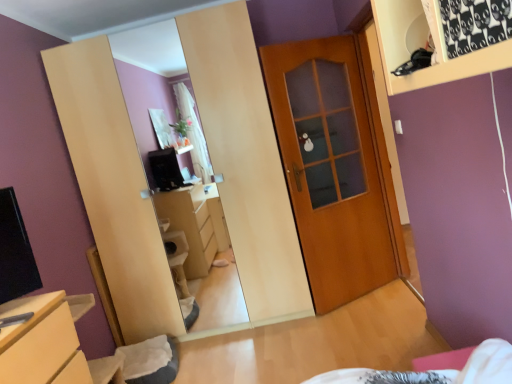
What do you see at coordinates (421, 44) in the screenshot? Image resolution: width=512 pixels, height=384 pixels. I see `black fabric at upper right` at bounding box center [421, 44].

The image size is (512, 384). What are the coordinates of `matte wood chest of drawers at lower left` in the screenshot? It's located at (40, 342).

This screenshot has width=512, height=384. In order to click on black fabric at upper right in this screenshot , I will do `click(421, 44)`.

Considering the sizes of matte wood chest of drawers at lower left and wooden door at center in the image, is matte wood chest of drawers at lower left bigger or smaller than wooden door at center?

Clearly, matte wood chest of drawers at lower left is larger in size than wooden door at center.

Is matte wood chest of drawers at lower left taller than wooden door at center?

No.

Is matte wood chest of drawers at lower left closer to the viewer compared to wooden door at center?

Yes, it is.

Which is correct: black fabric at upper right is inside matte wood chest of drawers at lower left, or outside of it?

The correct answer is: outside.

In terms of width, does black fabric at upper right look wider or thinner when compared to matte wood chest of drawers at lower left?

Clearly, black fabric at upper right has less width compared to matte wood chest of drawers at lower left.

What's the angular difference between black fabric at upper right and matte wood chest of drawers at lower left's facing directions?

The angular difference between black fabric at upper right and matte wood chest of drawers at lower left is 178 degrees.

Is black fabric at upper right turned away from matte wood chest of drawers at lower left?

No, black fabric at upper right is not facing the opposite direction of matte wood chest of drawers at lower left.

Measure the distance from matte wood chest of drawers at lower left to black fabric at upper right.

matte wood chest of drawers at lower left and black fabric at upper right are 1.55 meters apart from each other.

From the picture: From the image's perspective, relative to black fabric at upper right, is matte wood chest of drawers at lower left above or below?

Based on their image positions, matte wood chest of drawers at lower left is located beneath black fabric at upper right.

In terms of width, does matte wood chest of drawers at lower left look wider or thinner when compared to black fabric at upper right?

Clearly, matte wood chest of drawers at lower left has more width compared to black fabric at upper right.

Would you say wooden door at center is inside or outside matte wood chest of drawers at lower left?

wooden door at center lies outside matte wood chest of drawers at lower left.

Which object is wider, wooden door at center or matte wood chest of drawers at lower left?

matte wood chest of drawers at lower left.

Is wooden door at center facing towards matte wood chest of drawers at lower left?

No, wooden door at center is not aimed at matte wood chest of drawers at lower left.

In the scene shown: From a real-world perspective, is wooden door at center above or below matte wood chest of drawers at lower left?

Clearly, from a real-world perspective, wooden door at center is above matte wood chest of drawers at lower left.

Is wooden door at center taller or shorter than black fabric at upper right?

wooden door at center is taller than black fabric at upper right.

In terms of width, does wooden door at center look wider or thinner when compared to black fabric at upper right?

wooden door at center is thinner than black fabric at upper right.

Does point (377, 162) appear closer or farther from the camera than point (442, 67)?

Point (377, 162).

From the picture: From the image's perspective, which one is positioned lower, black fabric at upper right or wooden door at center?

From the image's view, wooden door at center is below.

Which point is more distant from viewer, (x=391, y=49) or (x=356, y=87)?

Positioned behind is point (x=356, y=87).

From the picture: Is wooden door at center at the back of black fabric at upper right?

black fabric at upper right does not have its back to wooden door at center.

From a real-world perspective, does black fabric at upper right sit lower than wooden door at center?

No, from a real-world perspective, black fabric at upper right is not beneath wooden door at center.

Identify the location of chest of drawers below the wooden door at center (from a real-world perspective). (40, 342).

Locate an element on the screen. The width and height of the screenshot is (512, 384). chest of drawers located on the left of black fabric at upper right is located at coordinates (40, 342).

Which object lies further to the anchor point black fabric at upper right, wooden door at center or matte wood chest of drawers at lower left?

wooden door at center.

Which object lies nearer to the anchor point wooden door at center, black fabric at upper right or matte wood chest of drawers at lower left?

Based on the image, matte wood chest of drawers at lower left appears to be nearer to wooden door at center.

Which object lies further to the anchor point black fabric at upper right, matte wood chest of drawers at lower left or wooden door at center?

wooden door at center is further to black fabric at upper right.

Estimate the real-world distances between objects in this image. Which object is closer to matte wood chest of drawers at lower left, wooden door at center or black fabric at upper right?

Based on the image, black fabric at upper right appears to be nearer to matte wood chest of drawers at lower left.

Considering their positions, is matte wood chest of drawers at lower left positioned further to wooden door at center than black fabric at upper right?

Based on the image, black fabric at upper right appears to be further to wooden door at center.

Based on their spatial positions, is black fabric at upper right or wooden door at center closer to matte wood chest of drawers at lower left?

black fabric at upper right is positioned closer to the anchor matte wood chest of drawers at lower left.

The height and width of the screenshot is (384, 512). In order to click on chest of drawers between black fabric at upper right and wooden door at center along the z-axis in this screenshot , I will do `click(40, 342)`.